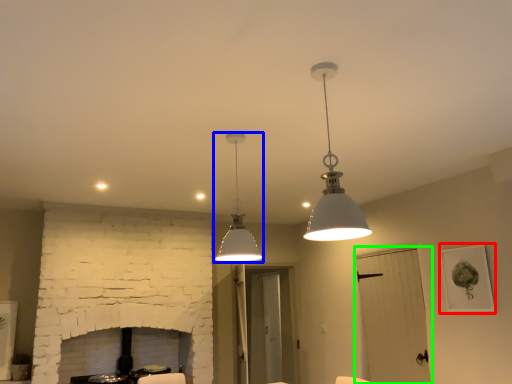
Question: Considering the real-world distances, which object is farthest from picture frame (highlighted by a red box)? lamp (highlighted by a blue box) or glass door (highlighted by a green box)?

Choices:
 (A) lamp
 (B) glass door

Answer: (A)